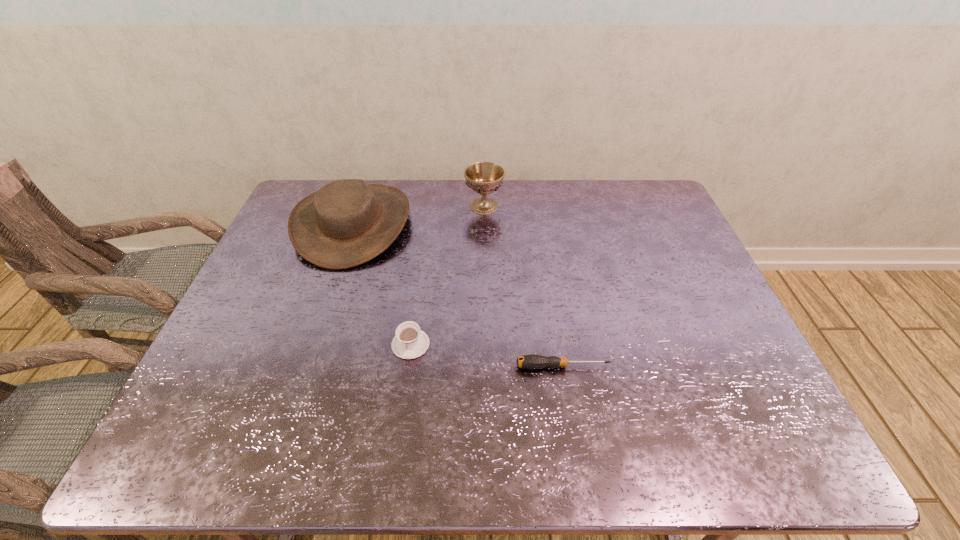
Locate an element on the screen. cowboy hat that is at the far edge is located at coordinates (346, 223).

The width and height of the screenshot is (960, 540). I want to click on chalice located at the far edge, so click(x=484, y=178).

At what (x,y) coordinates should I click in order to perform the action: click on object at the left edge. Please return your answer as a coordinate pair (x, y). The image size is (960, 540). Looking at the image, I should click on (346, 223).

The width and height of the screenshot is (960, 540). In order to click on object that is at the far left corner in this screenshot , I will do `click(346, 223)`.

The width and height of the screenshot is (960, 540). In the image, there is a desktop. Identify the location of vacant space at the far edge. (417, 209).

In the image, there is a desktop. Where is `vacant region at the near edge`? The image size is (960, 540). vacant region at the near edge is located at coordinates (265, 422).

Where is `free space at the left edge`? The image size is (960, 540). free space at the left edge is located at coordinates (274, 260).

Locate an element on the screen. Image resolution: width=960 pixels, height=540 pixels. vacant space at the right edge of the desktop is located at coordinates (660, 256).

Image resolution: width=960 pixels, height=540 pixels. In order to click on vacant space at the far right corner of the desktop in this screenshot , I will do `click(661, 214)`.

You are a GUI agent. You are given a task and a screenshot of the screen. Output one action in this format:
    pyautogui.click(x=<x>, y=<y>)
    Task: Click on the unoccupied area between the chalice and the rightmost object
    The image size is (960, 540).
    Given the screenshot: What is the action you would take?
    pyautogui.click(x=523, y=286)